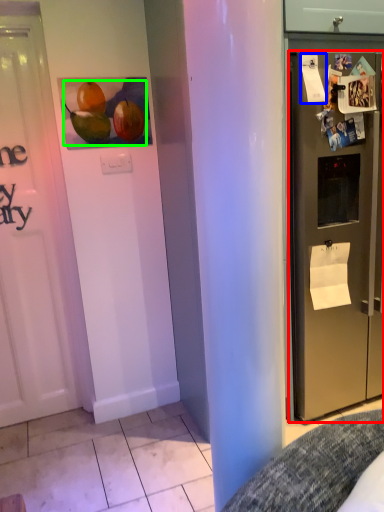
Question: Based on their relative distances, which object is farther from refrigerator (highlighted by a red box)? Choose from paper (highlighted by a blue box) and fruit (highlighted by a green box).

Choices:
 (A) paper
 (B) fruit

Answer: (B)